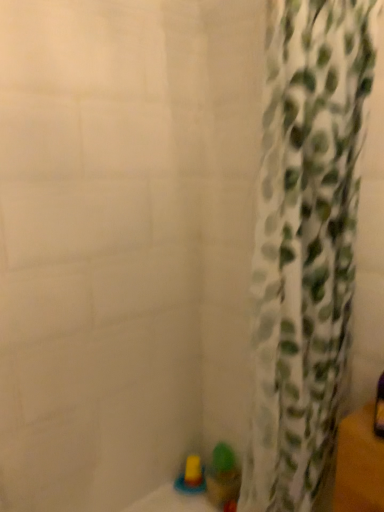
Question: Is translucent plastic cup at lower center, arranged as the first toy when viewed from the right, shorter than translucent yellow toy at lower center, the 2th toy from the right?

Choices:
 (A) no
 (B) yes

Answer: (A)

Question: Is translucent plastic cup at lower center, arranged as the first toy when viewed from the right, completely or partially outside of translucent yellow toy at lower center, which is counted as the 1th toy, starting from the left?

Choices:
 (A) no
 (B) yes

Answer: (B)

Question: Does translucent plastic cup at lower center, the second toy viewed from the left, have a greater width compared to translucent yellow toy at lower center, the 2th toy from the right?

Choices:
 (A) no
 (B) yes

Answer: (A)

Question: Is translucent plastic cup at lower center, the second toy viewed from the left, taller than translucent yellow toy at lower center, the 2th toy from the right?

Choices:
 (A) no
 (B) yes

Answer: (B)

Question: Is translucent plastic cup at lower center, the second toy viewed from the left, positioned behind translucent yellow toy at lower center, which is counted as the 1th toy, starting from the left?

Choices:
 (A) yes
 (B) no

Answer: (B)

Question: In terms of width, does translucent yellow toy at lower center, the 2th toy from the right, look wider or thinner when compared to white fabric curtain at right?

Choices:
 (A) wide
 (B) thin

Answer: (B)

Question: From the image's perspective, is translucent yellow toy at lower center, the 2th toy from the right, positioned above or below white fabric curtain at right?

Choices:
 (A) below
 (B) above

Answer: (A)

Question: Looking at the image, does translucent yellow toy at lower center, the 2th toy from the right, seem bigger or smaller compared to white fabric curtain at right?

Choices:
 (A) small
 (B) big

Answer: (A)

Question: Is translucent yellow toy at lower center, the 2th toy from the right, taller or shorter than white fabric curtain at right?

Choices:
 (A) short
 (B) tall

Answer: (A)

Question: Considering the positions of point (210, 498) and point (276, 268), is point (210, 498) closer or farther from the camera than point (276, 268)?

Choices:
 (A) closer
 (B) farther

Answer: (B)

Question: Is translucent plastic cup at lower center, arranged as the first toy when viewed from the right, taller or shorter than white fabric curtain at right?

Choices:
 (A) tall
 (B) short

Answer: (B)

Question: Is translucent plastic cup at lower center, arranged as the first toy when viewed from the right, inside the boundaries of white fabric curtain at right, or outside?

Choices:
 (A) inside
 (B) outside

Answer: (B)

Question: From the image's perspective, is translucent plastic cup at lower center, arranged as the first toy when viewed from the right, positioned above or below white fabric curtain at right?

Choices:
 (A) below
 (B) above

Answer: (A)

Question: In terms of height, does translucent yellow toy at lower center, the 2th toy from the right, look taller or shorter compared to translucent plastic cup at lower center, the second toy viewed from the left?

Choices:
 (A) tall
 (B) short

Answer: (B)

Question: Considering the positions of point (193, 458) and point (226, 463), is point (193, 458) closer or farther from the camera than point (226, 463)?

Choices:
 (A) farther
 (B) closer

Answer: (A)